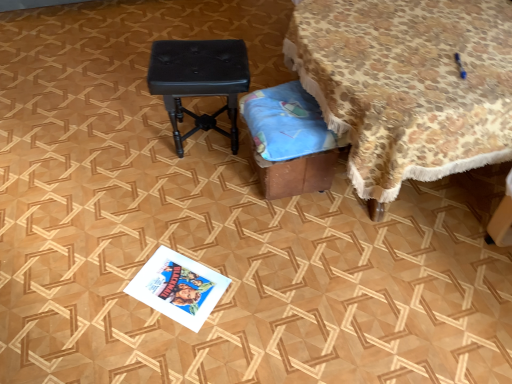
Identify the location of vacant region above brown cardboard box at lower center (from a real-world perspective). This screenshot has height=384, width=512. (288, 109).